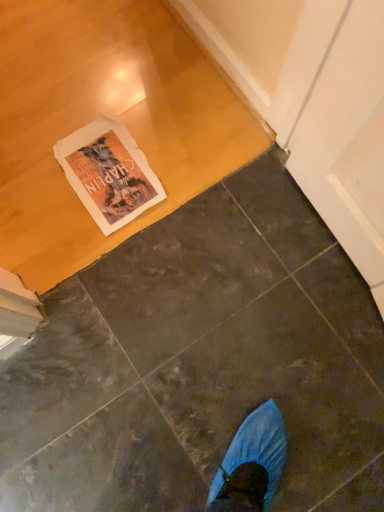
I want to click on empty space that is ontop of white paper magazine at upper left (from a real-world perspective), so click(x=98, y=160).